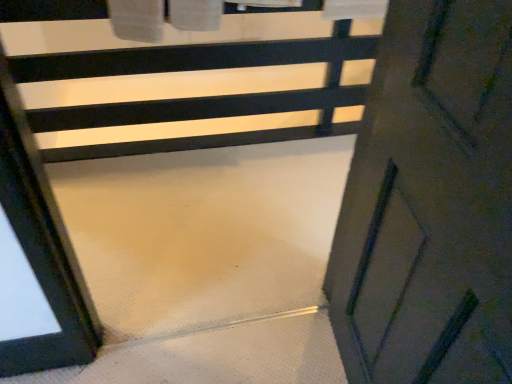
Question: From the image's perspective, is matte white door at lower right located above or below white matte stair at center?

Choices:
 (A) below
 (B) above

Answer: (A)

Question: Is matte white door at lower right wider or thinner than white matte stair at center?

Choices:
 (A) thin
 (B) wide

Answer: (A)

Question: Does point (486, 173) appear closer or farther from the camera than point (46, 81)?

Choices:
 (A) closer
 (B) farther

Answer: (A)

Question: In terms of width, does white matte stair at center look wider or thinner when compared to matte white door at lower right?

Choices:
 (A) thin
 (B) wide

Answer: (B)

Question: From their relative heights in the image, would you say white matte stair at center is taller or shorter than matte white door at lower right?

Choices:
 (A) tall
 (B) short

Answer: (B)

Question: Considering their positions, is white matte stair at center located in front of or behind matte white door at lower right?

Choices:
 (A) front
 (B) behind

Answer: (B)

Question: From a real-world perspective, is white matte stair at center above or below matte white door at lower right?

Choices:
 (A) above
 (B) below

Answer: (B)